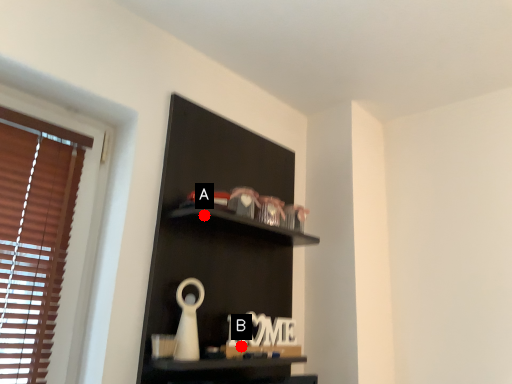
Question: Two points are circled on the image, labeled by A and B beside each circle. Which point appears closest to the camera in this image?

Choices:
 (A) A is closer
 (B) B is closer

Answer: (A)